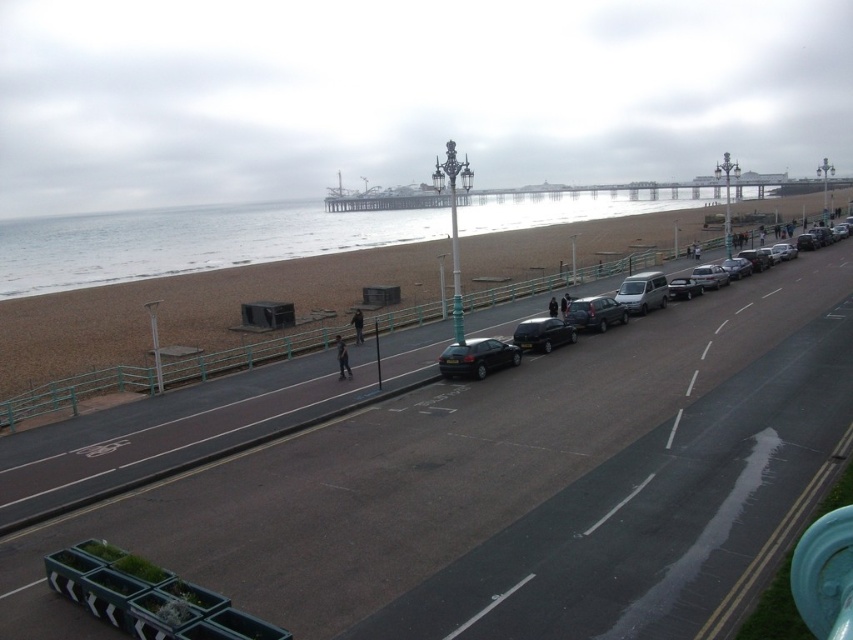
Question: Does brown sand at lower left have a smaller size compared to matte black car at center?

Choices:
 (A) yes
 (B) no

Answer: (B)

Question: Which point appears farthest from the camera in this image?

Choices:
 (A) (642, 275)
 (B) (699, 284)
 (C) (636, 227)

Answer: (C)

Question: Does satin black sedan at center have a lesser width compared to satin silver sedan at center-right?

Choices:
 (A) yes
 (B) no

Answer: (A)

Question: Can you confirm if shiny black sedan at center is positioned above satin silver sedan at center-right?

Choices:
 (A) yes
 (B) no

Answer: (B)

Question: Which object is farther from the camera taking this photo?

Choices:
 (A) metallic silver sedan at center-right
 (B) shiny silver sedan at center
 (C) brown sand at lower left

Answer: (A)

Question: Which of the following is the closest to the observer?

Choices:
 (A) (498, 348)
 (B) (386, 259)

Answer: (A)